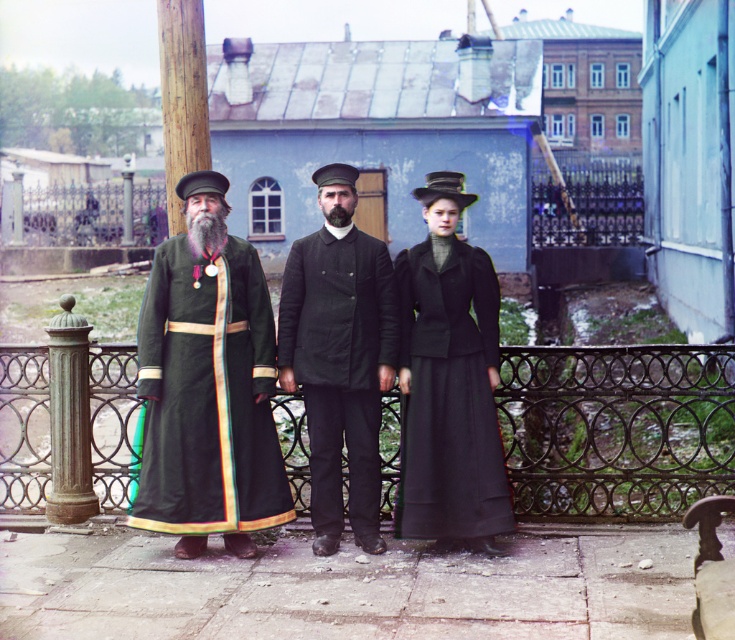
Who is more distant from viewer, (x=172, y=301) or (x=286, y=506)?

The point (x=286, y=506) is behind.

Which of these two, dark green velvet coat at center or velvet green robe at center, stands shorter?

velvet green robe at center is shorter.

Where is `dark green velvet coat at center`? Image resolution: width=735 pixels, height=640 pixels. dark green velvet coat at center is located at coordinates (262, 385).

Can you confirm if iron wire fence at center is bigger than matte black dress at center?

Indeed, iron wire fence at center has a larger size compared to matte black dress at center.

From the picture: Measure the distance between iron wire fence at center and camera.

The distance of iron wire fence at center from camera is 7.32 meters.

Where is `iron wire fence at center`? Image resolution: width=735 pixels, height=640 pixels. iron wire fence at center is located at coordinates (616, 428).

Between iron wire fence at center and velvet green robe at center, which one is positioned higher?

velvet green robe at center is higher up.

Does iron wire fence at center appear over velvet green robe at center?

No.

Describe the element at coordinates (616, 428) in the screenshot. I see `iron wire fence at center` at that location.

At what (x,y) coordinates should I click in order to perform the action: click on iron wire fence at center. Please return your answer as a coordinate pair (x, y). The height and width of the screenshot is (640, 735). Looking at the image, I should click on click(x=616, y=428).